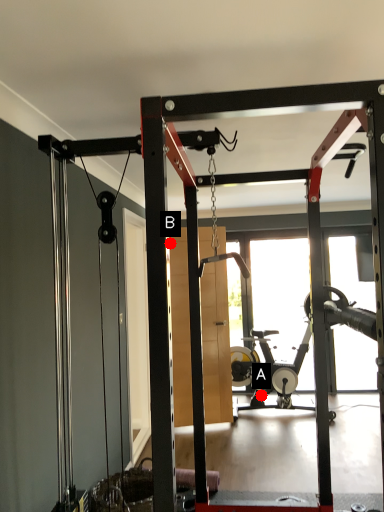
Question: Two points are circled on the image, labeled by A and B beside each circle. Which point is farther to the camera?

Choices:
 (A) A is further
 (B) B is further

Answer: (A)